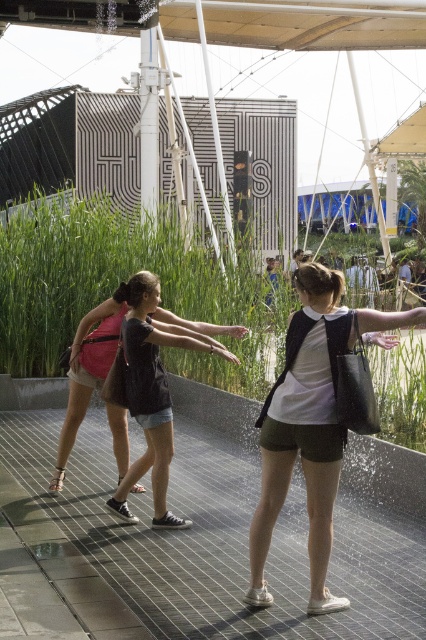
Where is `matte black tote bag at center`? The height and width of the screenshot is (640, 426). matte black tote bag at center is located at coordinates (305, 432).

Does point (379, 324) lie in front of point (161, 378)?

Yes, it is in front of point (161, 378).

The height and width of the screenshot is (640, 426). What do you see at coordinates (305, 432) in the screenshot? I see `matte black tote bag at center` at bounding box center [305, 432].

This screenshot has height=640, width=426. I want to click on matte black tote bag at center, so click(x=305, y=432).